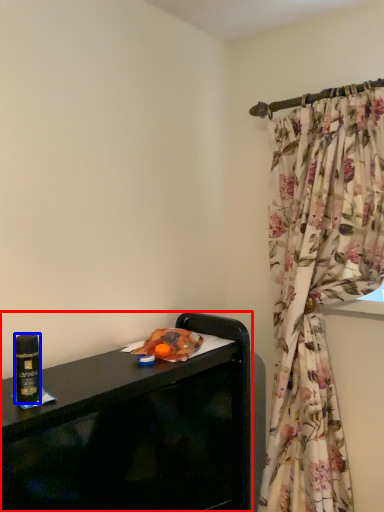
Question: Among these objects, which one is farthest to the camera, furniture (highlighted by a red box) or beverage (highlighted by a blue box)?

Choices:
 (A) furniture
 (B) beverage

Answer: (A)